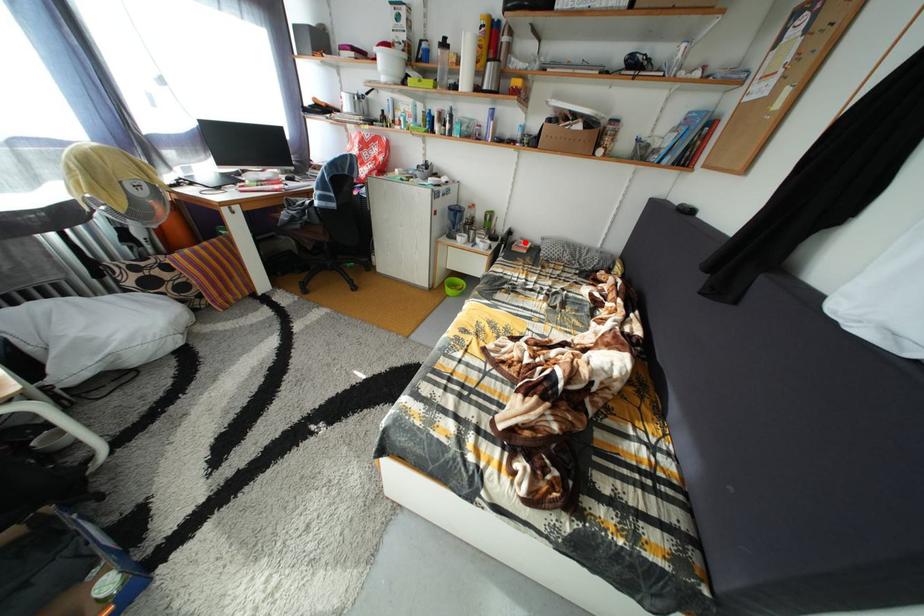
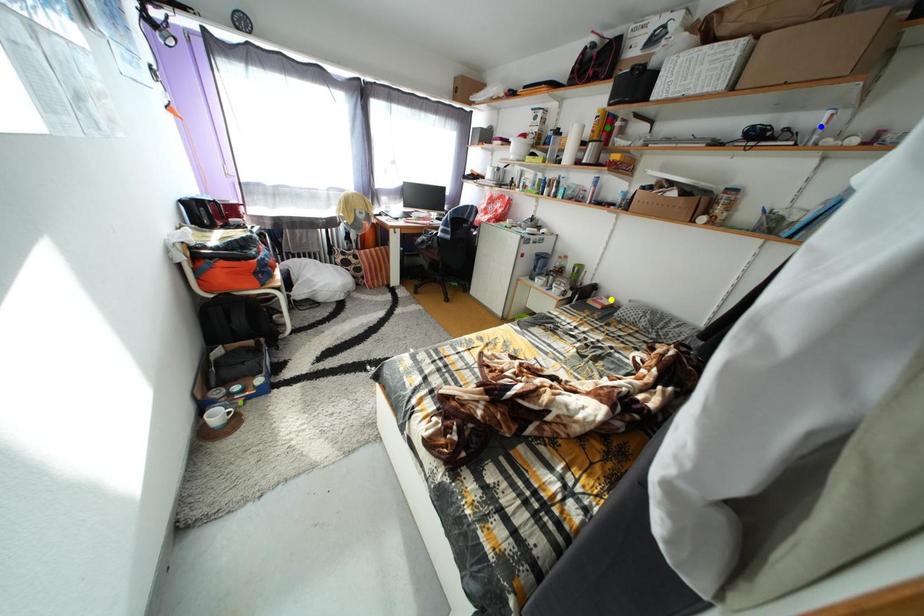
Question: I am providing you with two images of the same scene from different viewpoints. A red point is marked on the first image. You are given multiple points on the second image. Which point in image 2 represents the same 3d spot as the red point in image 1?

Choices:
 (A) blue point
 (B) yellow point
 (C) green point

Answer: (B)